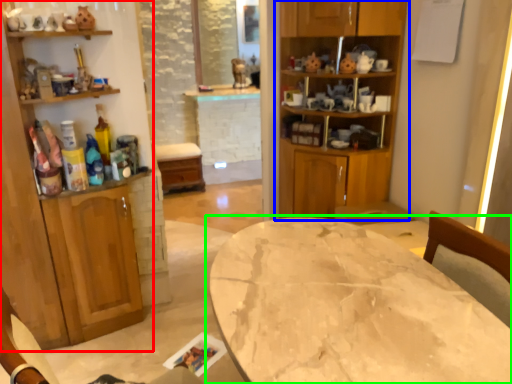
Question: Which is farther away from cabinetry (highlighted by a red box)? cabinetry (highlighted by a blue box) or table (highlighted by a green box)?

Choices:
 (A) cabinetry
 (B) table

Answer: (B)